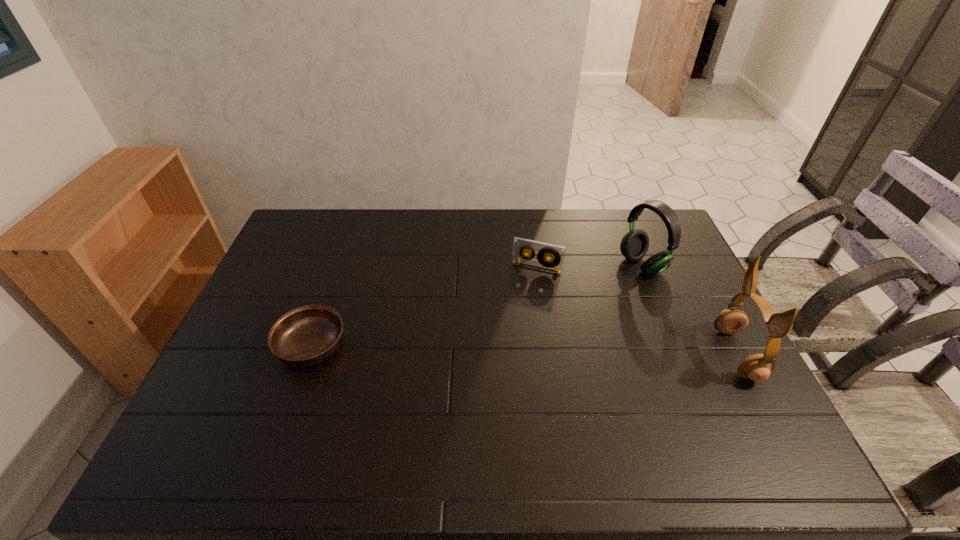
Locate an element on the screen. free space on the desktop that is between the soup bowl and the rightmost object and is positioned at the front of the third object from right to left with visible reels is located at coordinates (507, 350).

At what (x,y) coordinates should I click in order to perform the action: click on free space on the desktop that is between the soup bowl and the earphone and is positioned on the ear cups of the second tallest object. Please return your answer as a coordinate pair (x, y). Looking at the image, I should click on coord(464,349).